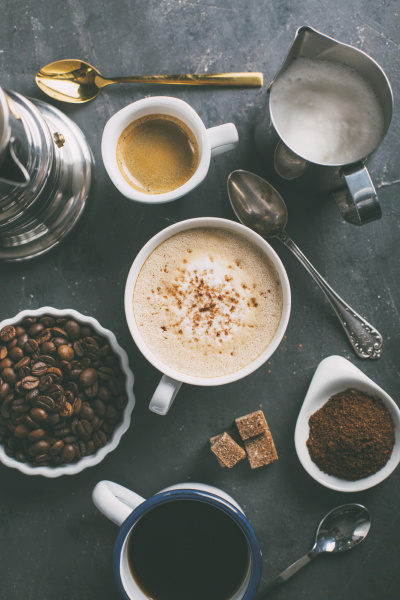
The width and height of the screenshot is (400, 600). Find the location of `handles`. handles is located at coordinates 250,79, 367,337, 360,215, 162,403, 114,499, 330,370, 260,595.